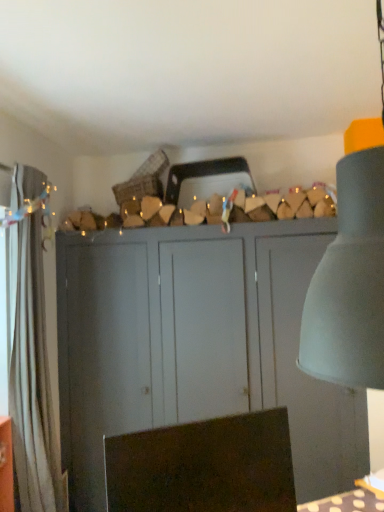
Question: Considering the relative sizes of white fabric curtain at left and brown fabric swivel chair at lower center in the image provided, is white fabric curtain at left wider than brown fabric swivel chair at lower center?

Choices:
 (A) yes
 (B) no

Answer: (A)

Question: Is white fabric curtain at left facing towards brown fabric swivel chair at lower center?

Choices:
 (A) yes
 (B) no

Answer: (B)

Question: Is white fabric curtain at left far away from brown fabric swivel chair at lower center?

Choices:
 (A) no
 (B) yes

Answer: (B)

Question: From a real-world perspective, is white fabric curtain at left on brown fabric swivel chair at lower center?

Choices:
 (A) yes
 (B) no

Answer: (A)

Question: From the image's perspective, is white fabric curtain at left on brown fabric swivel chair at lower center?

Choices:
 (A) yes
 (B) no

Answer: (A)

Question: Can you see white fabric curtain at left touching brown fabric swivel chair at lower center?

Choices:
 (A) yes
 (B) no

Answer: (B)

Question: Is brown fabric swivel chair at lower center outside of matte gray cupboard at center?

Choices:
 (A) no
 (B) yes

Answer: (B)

Question: Is brown fabric swivel chair at lower center not near matte gray cupboard at center?

Choices:
 (A) no
 (B) yes

Answer: (B)

Question: From the image's perspective, is brown fabric swivel chair at lower center located above matte gray cupboard at center?

Choices:
 (A) yes
 (B) no

Answer: (A)

Question: Is brown fabric swivel chair at lower center oriented away from matte gray cupboard at center?

Choices:
 (A) yes
 (B) no

Answer: (A)

Question: Would you say matte gray cupboard at center is part of brown fabric swivel chair at lower center's contents?

Choices:
 (A) no
 (B) yes

Answer: (A)

Question: Does brown fabric swivel chair at lower center touch matte gray cupboard at center?

Choices:
 (A) yes
 (B) no

Answer: (B)

Question: Is white fabric curtain at left a part of brown fabric swivel chair at lower center?

Choices:
 (A) no
 (B) yes

Answer: (A)